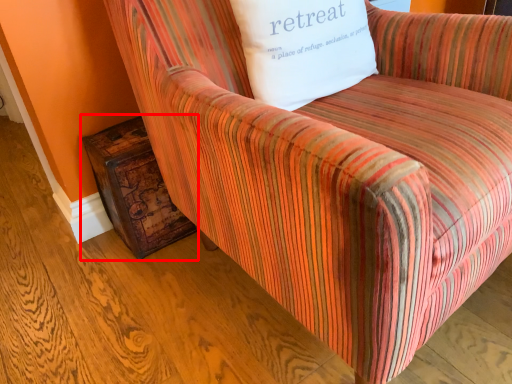
Question: Where is side table (annotated by the red box) located in relation to pillow in the image?

Choices:
 (A) left
 (B) right

Answer: (A)